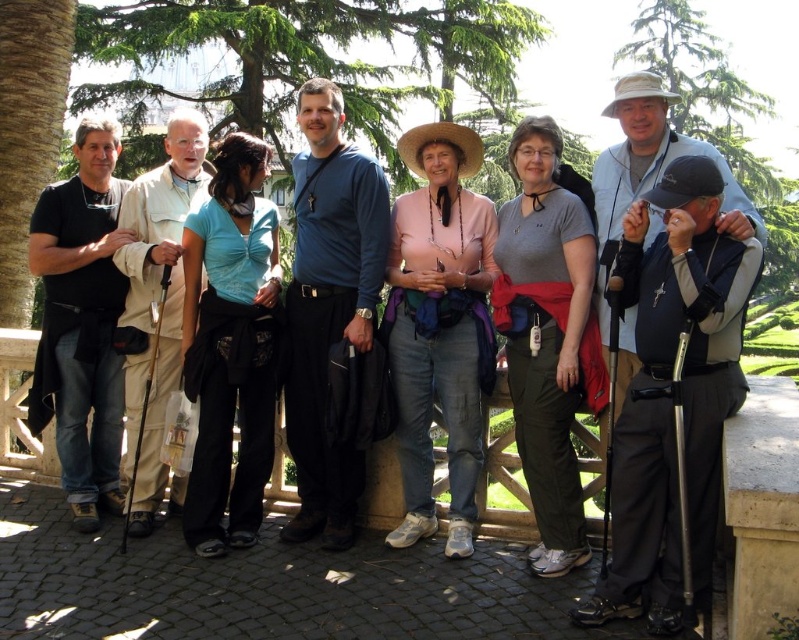
Question: Is gray fabric shirt at center further to the viewer compared to black matte jacket at left?

Choices:
 (A) yes
 (B) no

Answer: (B)

Question: Which point appears farthest from the camera in this image?

Choices:
 (A) (189, 381)
 (B) (424, 339)

Answer: (B)

Question: In this image, where is pink cotton shirt at center located relative to black matte jacket at left?

Choices:
 (A) left
 (B) right

Answer: (B)

Question: Can you confirm if pink cotton shirt at center is wider than black matte jacket at left?

Choices:
 (A) no
 (B) yes

Answer: (A)

Question: Among these objects, which one is nearest to the camera?

Choices:
 (A) pink cotton shirt at center
 (B) black matte jacket at left
 (C) gray fabric shirt at center

Answer: (C)

Question: Which of the following is the farthest from the observer?

Choices:
 (A) pink cotton shirt at center
 (B) blue matte shirt at center
 (C) blue fabric shirt at center

Answer: (B)